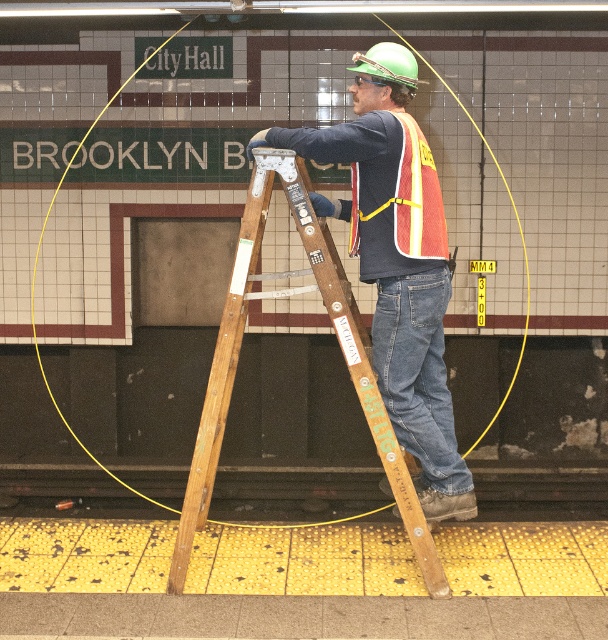
You are a pedestrian at the subway station and want to avoid the wooden ladder at center. Which direction should you move to stay away from it while still being visible to the worker wearing the reflective orange safety vest at center?

The reflective orange safety vest at center is behind the wooden ladder at center. To avoid the ladder while staying visible, move to the front side of the ladder where the worker can see you directly without the ladder obstructing the view.

You are a maintenance worker at the City Hall subway station. You need to reach a point that is further away from you. Which point should you move towards, point 1 at coordinates (x=451, y=493) or point 2 at coordinates (x=395, y=141)?

You should move towards point 1 at coordinates (x=451, y=493) because it is further to the camera, meaning it is further away from your current position.

You are a safety inspector at the subway station. You need to check if the matte orange safety vest at center is properly positioned over the wooden ladder at center. According to the safety guidelines, the vest must be placed above the ladder to avoid tripping hazards. Is the current placement compliant?

The matte orange safety vest at center is located above the wooden ladder at center, so the current placement is compliant with the safety guidelines.